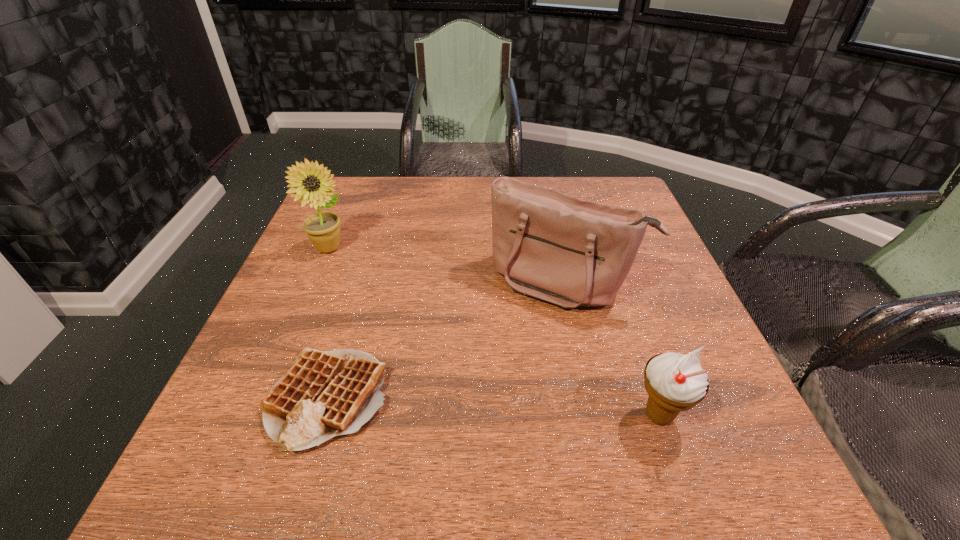
Where is `free space on the desktop that is between the waffle and the second shortest object and is positioned on the front pocket of the shoulder bag`? The image size is (960, 540). free space on the desktop that is between the waffle and the second shortest object and is positioned on the front pocket of the shoulder bag is located at coordinates (495, 407).

Locate an element on the screen. vacant spot on the desktop that is between the shortest object and the second shortest object and is positioned on the face of the sunflower is located at coordinates coord(538,409).